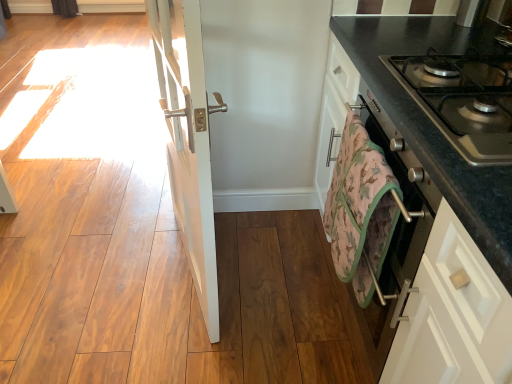
Where is `vacant space to the left of white glossy door at center`? The width and height of the screenshot is (512, 384). vacant space to the left of white glossy door at center is located at coordinates (104, 273).